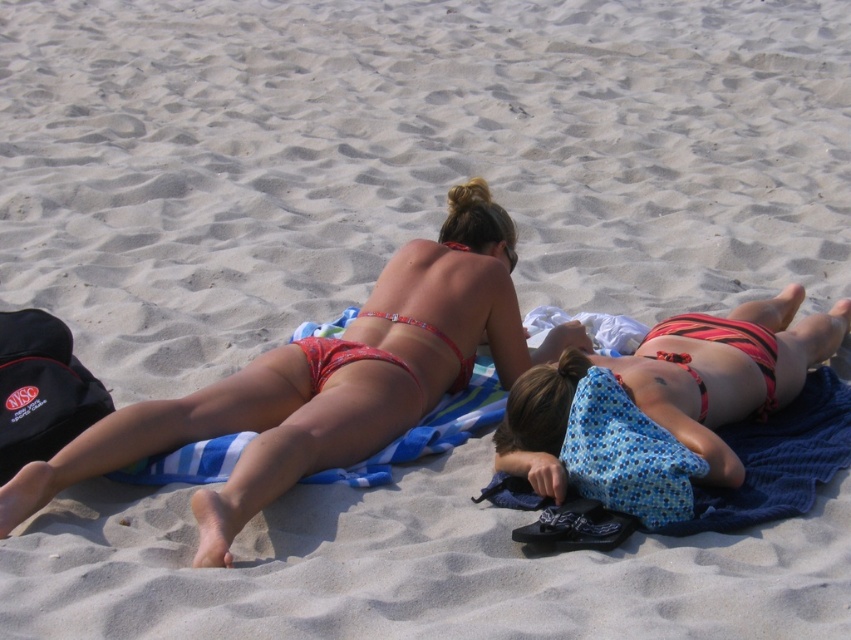
Is the position of matte red bikini at upper center less distant than that of striped bikini at center?

Yes, it is.

Locate an element on the screen. The height and width of the screenshot is (640, 851). matte red bikini at upper center is located at coordinates (327, 381).

Which is behind, point (497, 275) or point (672, 365)?

The point (497, 275) is more distant.

Where is `matte red bikini at upper center`? The height and width of the screenshot is (640, 851). matte red bikini at upper center is located at coordinates (327, 381).

Locate an element on the screen. striped bikini at center is located at coordinates (674, 387).

Who is more distant from viewer, (x=577, y=381) or (x=767, y=339)?

Point (x=767, y=339)

Where is `striped bikini at center`? striped bikini at center is located at coordinates (674, 387).

The height and width of the screenshot is (640, 851). I want to click on striped bikini at center, so click(x=674, y=387).

Can you confirm if matte red bikini at upper center is positioned below red matte bikini top at center?

Correct, matte red bikini at upper center is located below red matte bikini top at center.

Can you confirm if matte red bikini at upper center is taller than red matte bikini top at center?

Indeed, matte red bikini at upper center has a greater height compared to red matte bikini top at center.

Is point (43, 474) positioned after point (700, 392)?

No, it is not.

This screenshot has width=851, height=640. In order to click on matte red bikini at upper center in this screenshot , I will do `click(327, 381)`.